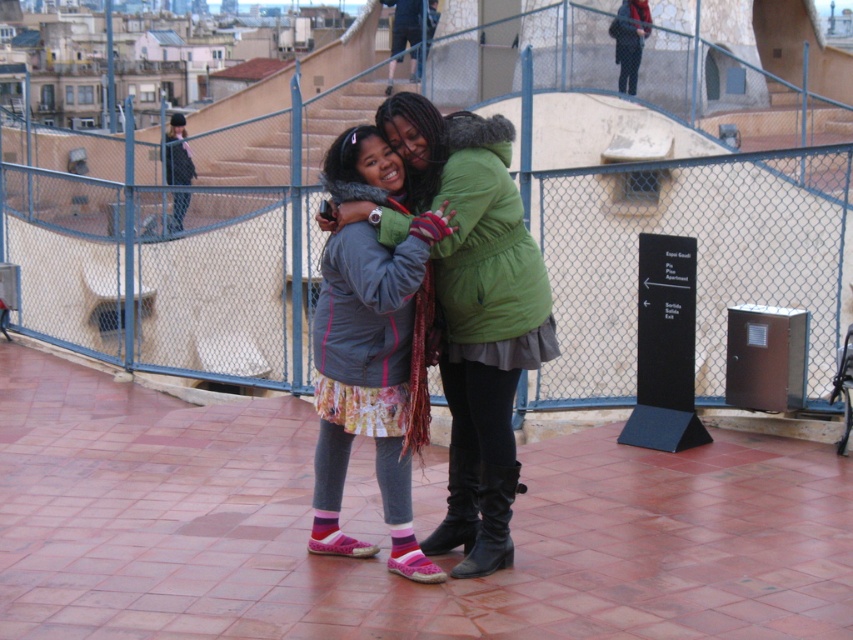
Consider the image. Does blue wire mesh at center have a greater width compared to matte gray jacket at center?

Yes, blue wire mesh at center is wider than matte gray jacket at center.

Between point (117, 358) and point (378, 472), which one is positioned behind?

Point (117, 358)

Is point (96, 205) in front of point (343, 330)?

No.

Where is `blue wire mesh at center`? blue wire mesh at center is located at coordinates (659, 186).

Can you confirm if blue wire mesh at center is positioned to the right of black leather boot at center?

No, blue wire mesh at center is not to the right of black leather boot at center.

Which is more to the left, blue wire mesh at center or black leather boot at center?

From the viewer's perspective, blue wire mesh at center appears more on the left side.

Which is in front, point (235, 291) or point (474, 541)?

Positioned in front is point (474, 541).

Where is `blue wire mesh at center`? Image resolution: width=853 pixels, height=640 pixels. blue wire mesh at center is located at coordinates (659, 186).

Between blue wire mesh at center and black leather boot at lower center, which one is positioned higher?

Positioned higher is blue wire mesh at center.

Who is positioned more to the left, blue wire mesh at center or black leather boot at lower center?

blue wire mesh at center is more to the left.

Between point (732, 296) and point (445, 531), which one is positioned behind?

Point (732, 296)

Locate an element on the screen. The height and width of the screenshot is (640, 853). blue wire mesh at center is located at coordinates (659, 186).